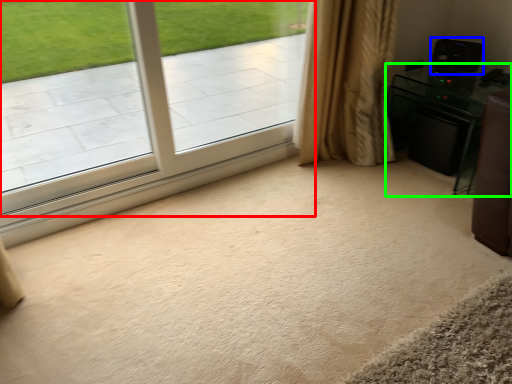
Question: Which object is positioned farthest from window (highlighted by a red box)? Select from speaker (highlighted by a blue box) and furniture (highlighted by a green box).

Choices:
 (A) speaker
 (B) furniture

Answer: (A)